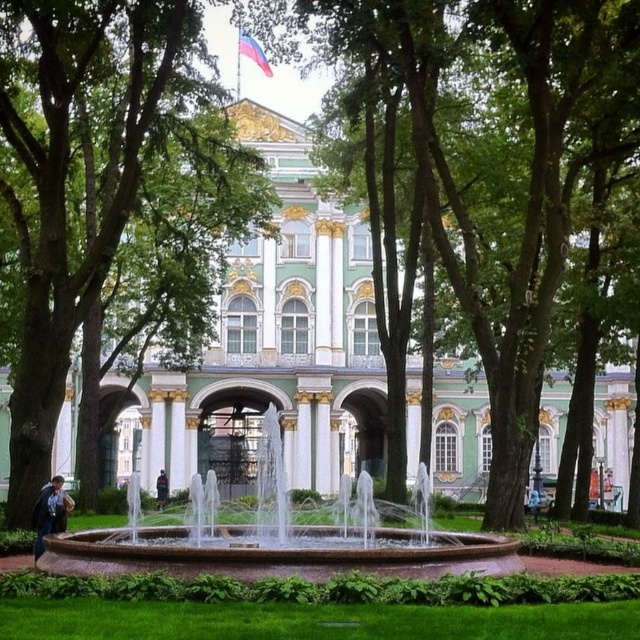
Question: Among these points, which one is nearest to the camera?

Choices:
 (A) pyautogui.click(x=60, y=477)
 (B) pyautogui.click(x=76, y=236)

Answer: (A)

Question: Can you confirm if green leafy tree at center is smaller than dark blue jacket at center?

Choices:
 (A) yes
 (B) no

Answer: (B)

Question: Which point is closer to the camera?

Choices:
 (A) (236, 115)
 (B) (35, 49)
 (C) (38, 554)
 (D) (163, 468)

Answer: (C)

Question: Can you confirm if green marble palace at center is positioned above white marble fountain at center?

Choices:
 (A) no
 (B) yes

Answer: (B)

Question: From the image, what is the correct spatial relationship of white marble fountain at center in relation to dark blue jacket at center?

Choices:
 (A) below
 (B) above

Answer: (B)

Question: Which point is farther to the camera?

Choices:
 (A) white marble fountain at center
 (B) denim jacket at lower left
 (C) green leafy tree at center

Answer: (C)